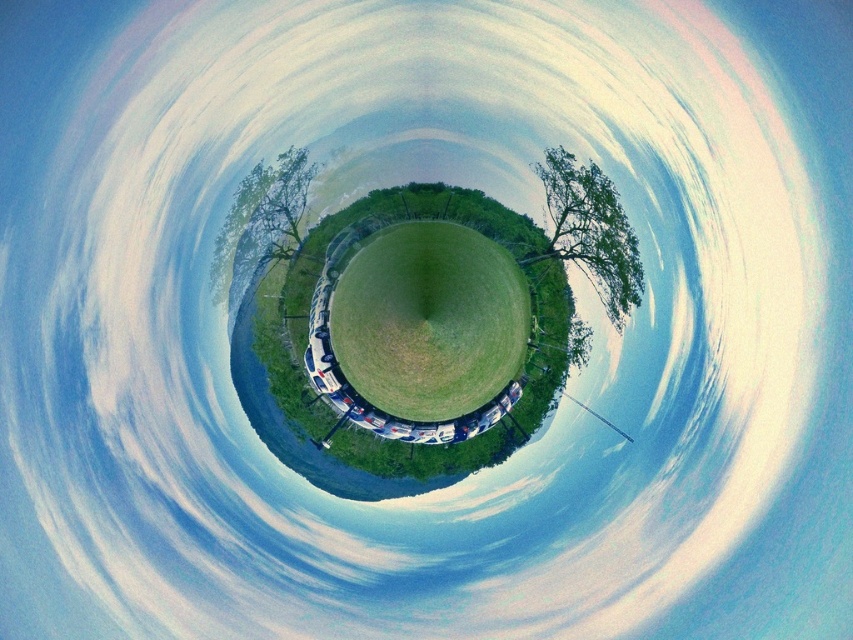
Question: Among these points, which one is farthest from the camera?

Choices:
 (A) (378, 243)
 (B) (287, 152)

Answer: (A)

Question: Estimate the real-world distances between objects in this image. Which object is farther from the green grassy field at center?

Choices:
 (A) green leafy tree at upper right
 (B) green leafy tree at center

Answer: (B)

Question: Which object is the closest to the green leafy tree at upper right?

Choices:
 (A) green leafy tree at center
 (B) green grassy field at center

Answer: (B)

Question: Is the position of green grassy field at center less distant than that of green leafy tree at center?

Choices:
 (A) no
 (B) yes

Answer: (A)

Question: Considering the relative positions of green grassy field at center and green leafy tree at upper right in the image provided, where is green grassy field at center located with respect to green leafy tree at upper right?

Choices:
 (A) left
 (B) right

Answer: (A)

Question: Is green leafy tree at upper right positioned behind green leafy tree at center?

Choices:
 (A) yes
 (B) no

Answer: (A)